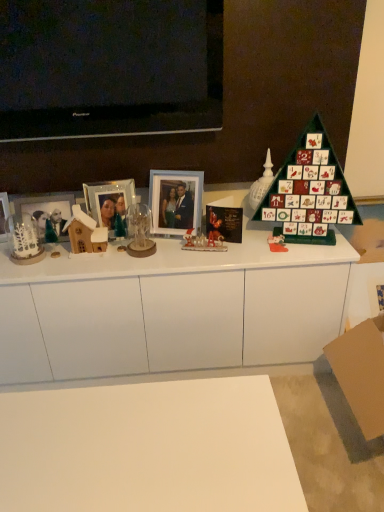
Question: Relative to white glossy cabinet at center, is black paper christmas card at center in front or behind?

Choices:
 (A) front
 (B) behind

Answer: (B)

Question: Is black paper christmas card at center wider or thinner than white glossy cabinet at center?

Choices:
 (A) thin
 (B) wide

Answer: (A)

Question: Which is farther from the clear glass ornament at center, the fourth toy viewed from the right?

Choices:
 (A) matte wooden picture frame at left, the 3th picture frame from the right
 (B) white frosted glass jar at left, which is counted as the first toy, starting from the left
 (C) white matte desk at lower center
 (D) matte glass picture frame at center left, the 2th picture frame from the right
 (E) green matte advent calendar at right

Answer: (C)

Question: Estimate the real-world distances between objects in this image. Which object is closer to the white glossy santa claus at center, the 3th toy in the right-to-left sequence?

Choices:
 (A) matte wooden picture frame at left, marked as the 1th picture frame in a left-to-right arrangement
 (B) matte glass picture frame at center left, the 2th picture frame from the right
 (C) white frosted glass jar at left, which is counted as the first toy, starting from the left
 (D) black paper christmas card at center
 (E) clear glass ornament at center, the fourth toy viewed from the right

Answer: (D)